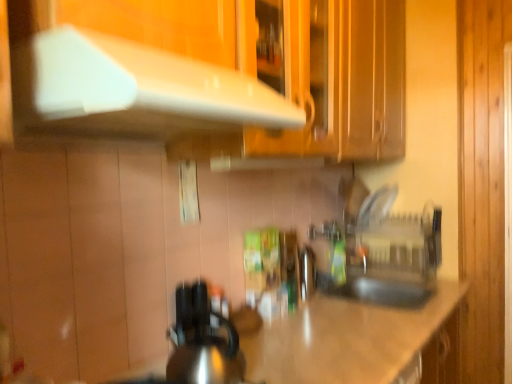
Question: Does green matte bottle at center come behind transparent plastic sink at center?

Choices:
 (A) yes
 (B) no

Answer: (A)

Question: Is green matte bottle at center positioned beyond the bounds of transparent plastic sink at center?

Choices:
 (A) yes
 (B) no

Answer: (A)

Question: Is green matte bottle at center oriented away from transparent plastic sink at center?

Choices:
 (A) yes
 (B) no

Answer: (B)

Question: Could you tell me if green matte bottle at center is turned towards transparent plastic sink at center?

Choices:
 (A) no
 (B) yes

Answer: (A)

Question: Considering the relative sizes of green matte bottle at center and transparent plastic sink at center in the image provided, is green matte bottle at center smaller than transparent plastic sink at center?

Choices:
 (A) yes
 (B) no

Answer: (A)

Question: In terms of height, does green matte bottle at center look taller or shorter compared to shiny metallic kettle at center?

Choices:
 (A) tall
 (B) short

Answer: (B)

Question: In the image, is green matte bottle at center on the left side or the right side of shiny metallic kettle at center?

Choices:
 (A) right
 (B) left

Answer: (A)

Question: From the image's perspective, is green matte bottle at center located above or below shiny metallic kettle at center?

Choices:
 (A) above
 (B) below

Answer: (A)

Question: Choose the correct answer: Is green matte bottle at center inside shiny metallic kettle at center or outside it?

Choices:
 (A) outside
 (B) inside

Answer: (A)

Question: From the image's perspective, is shiny metallic kettle at center located above or below shiny metallic countertop at center?

Choices:
 (A) above
 (B) below

Answer: (A)

Question: From their relative heights in the image, would you say shiny metallic kettle at center is taller or shorter than shiny metallic countertop at center?

Choices:
 (A) short
 (B) tall

Answer: (A)

Question: Would you say shiny metallic kettle at center is to the left or to the right of shiny metallic countertop at center in the picture?

Choices:
 (A) right
 (B) left

Answer: (B)

Question: From a real-world perspective, is shiny metallic kettle at center positioned above or below shiny metallic countertop at center?

Choices:
 (A) below
 (B) above

Answer: (B)

Question: From a real-world perspective, is white glossy exhaust hood at upper center above or below shiny metallic countertop at center?

Choices:
 (A) below
 (B) above

Answer: (B)

Question: Considering the positions of white glossy exhaust hood at upper center and shiny metallic countertop at center in the image, is white glossy exhaust hood at upper center taller or shorter than shiny metallic countertop at center?

Choices:
 (A) tall
 (B) short

Answer: (B)